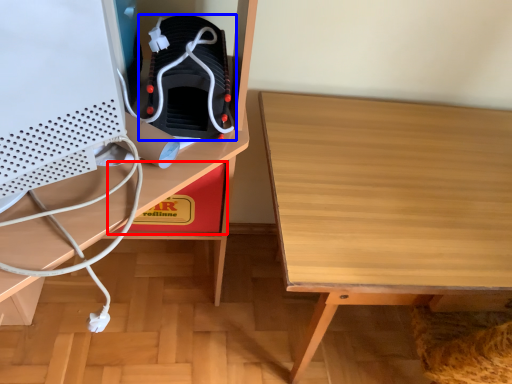
Question: Which object is closer to the camera taking this photo, cardboard box (highlighted by a red box) or footwear (highlighted by a blue box)?

Choices:
 (A) cardboard box
 (B) footwear

Answer: (B)